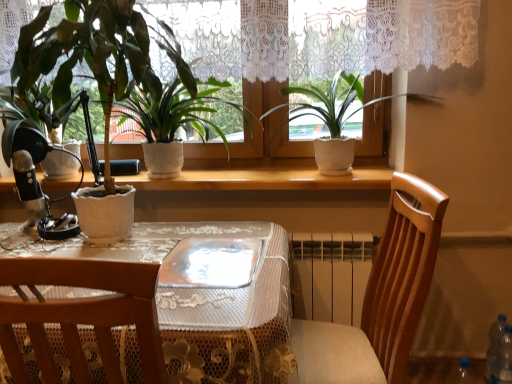
Question: In terms of size, does transparent plastic bottle at lower right appear bigger or smaller than matte white pot at left, which is the third houseplant in right-to-left order?

Choices:
 (A) big
 (B) small

Answer: (B)

Question: From a real-world perspective, is transparent plastic bottle at lower right physically located above or below matte white pot at left, the 1th houseplant in the left-to-right sequence?

Choices:
 (A) above
 (B) below

Answer: (B)

Question: Estimate the real-world distances between objects in this image. Which object is farther from the transparent plastic bottle at lower right?

Choices:
 (A) white textured pot at center, which is the third houseplant from left to right
 (B) wooden table at center
 (C) matte white pot at left, which is the third houseplant in right-to-left order
 (D) wooden chair at center
 (E) wooden at upper center

Answer: (C)

Question: Estimate the real-world distances between objects in this image. Which object is farther from the wooden table at center?

Choices:
 (A) wooden at upper center
 (B) white textured pot at center, which is the third houseplant from left to right
 (C) transparent glass plate at center
 (D) wooden chair at center
 (E) white textured pot at center, which is counted as the 2th houseplant, starting from the right

Answer: (B)